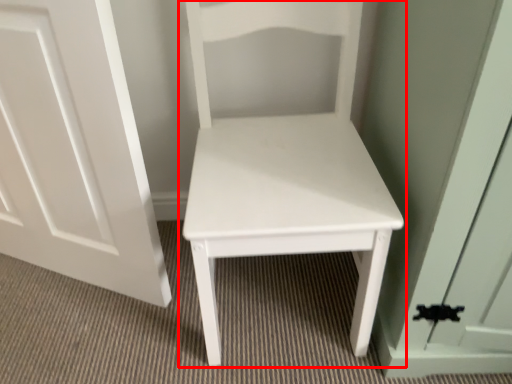
Question: From the image's perspective, considering the relative positions of furniture (annotated by the red box) and door in the image provided, where is furniture (annotated by the red box) located with respect to the staircase?

Choices:
 (A) below
 (B) above

Answer: (A)